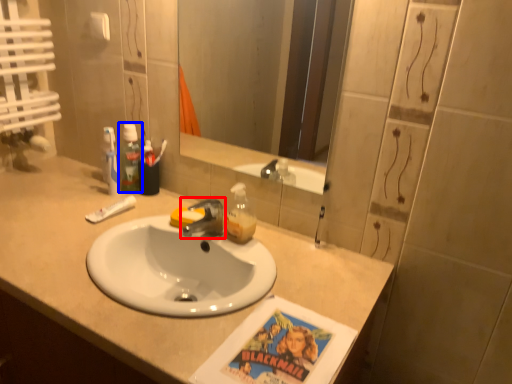
Question: Which of the following is the farthest to the observer, tap (highlighted by a red box) or mouthwash (highlighted by a blue box)?

Choices:
 (A) tap
 (B) mouthwash

Answer: (B)